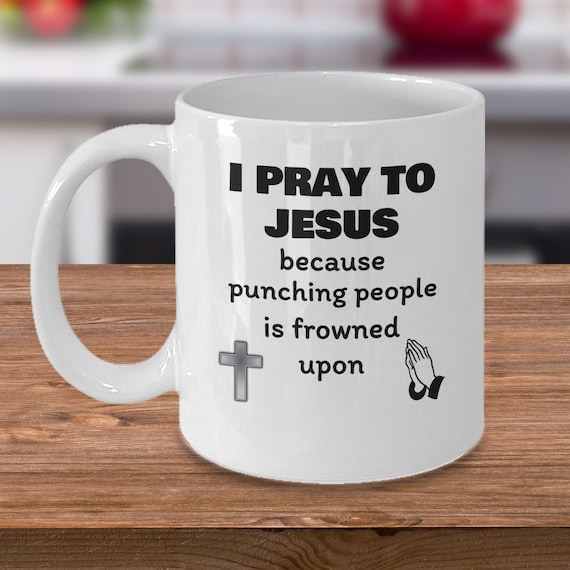
Identify the location of blurry red object on white countertop, upper right side. This screenshot has width=570, height=570. (465, 22).